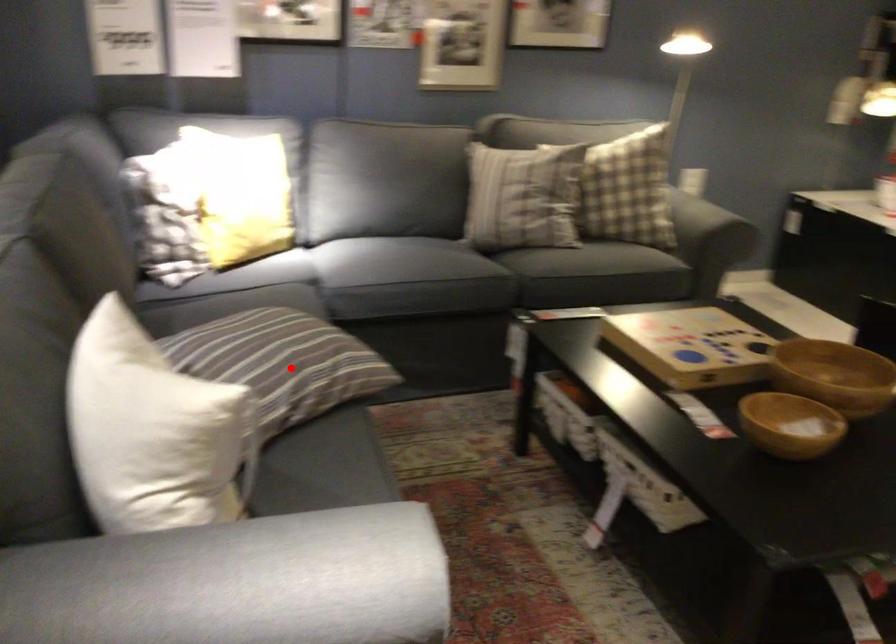
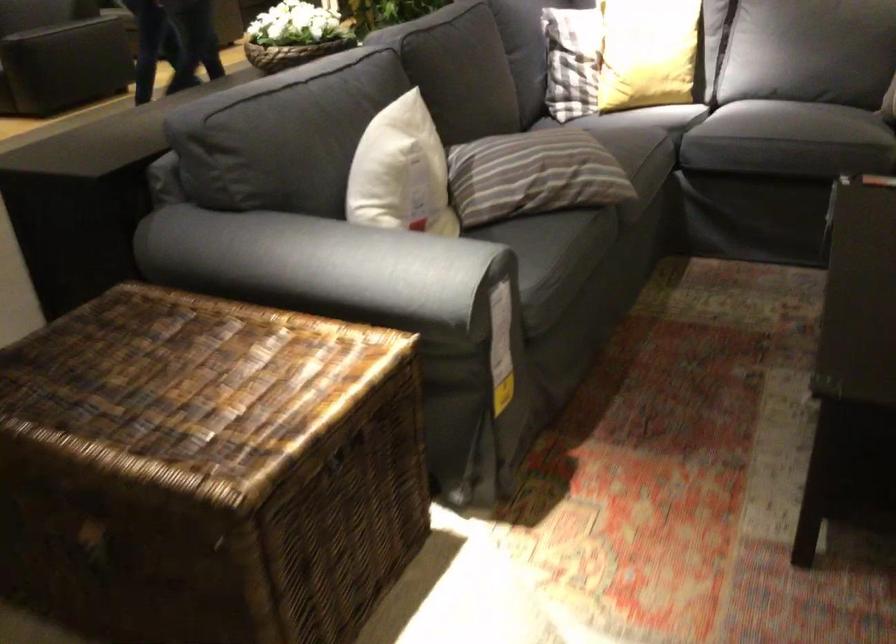
Question: I am providing you with two images of the same scene from different viewpoints. Given a red point in image1, look at the same physical point in image2. Is it:

Choices:
 (A) Closer to the viewpoint
 (B) Farther from the viewpoint

Answer: (B)